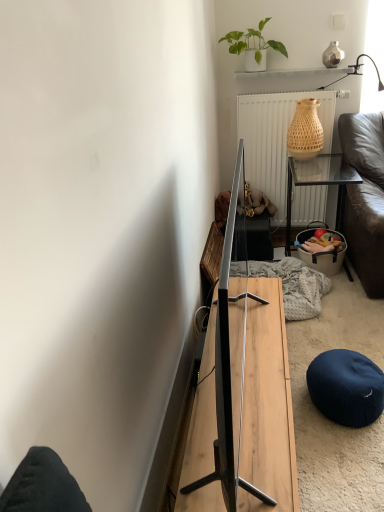
Based on the photo, measure the distance between light wood table at center, marked as the 1th table in a bottom-to-top arrangement, and camera.

The depth of light wood table at center, marked as the 1th table in a bottom-to-top arrangement, is 3.60 feet.

Locate an element on the screen. light wood table at center, arranged as the second table when viewed from the top is located at coordinates (268, 400).

Identify the location of wooden table at right, which is counted as the 2th table, starting from the left. (319, 183).

Identify the location of dark blue fabric stool at lower right. This screenshot has width=384, height=512. (346, 387).

What do you see at coordinates (346, 387) in the screenshot?
I see `dark blue fabric stool at lower right` at bounding box center [346, 387].

Locate an element on the screen. The image size is (384, 512). light wood table at center, positioned as the 2th table in back-to-front order is located at coordinates (268, 400).

Considering the relative sizes of white textured radiator at upper center and light wood table at center, arranged as the second table when viewed from the top, in the image provided, is white textured radiator at upper center shorter than light wood table at center, arranged as the second table when viewed from the top,?

No.

Is white textured radiator at upper center next to light wood table at center, positioned as the 2th table in back-to-front order?

There is a gap between white textured radiator at upper center and light wood table at center, positioned as the 2th table in back-to-front order.

Which is behind, white textured radiator at upper center or light wood table at center, marked as the 1th table in a bottom-to-top arrangement?

white textured radiator at upper center.

Can you tell me how much white textured radiator at upper center and light wood table at center, the first table viewed from the left, differ in facing direction?

88.5 degrees.

From the image's perspective, is white textured radiator at upper center located above or below wooden table at right, the first table from the back?

white textured radiator at upper center is above wooden table at right, the first table from the back.

In terms of size, does white textured radiator at upper center appear bigger or smaller than wooden table at right, the second table when ordered from front to back?

Considering their sizes, white textured radiator at upper center takes up less space than wooden table at right, the second table when ordered from front to back.

How much distance is there between white textured radiator at upper center and wooden table at right, the first table from the back?

white textured radiator at upper center is 7.06 inches away from wooden table at right, the first table from the back.

Where is `radiator on the left of wooden table at right, the first table from the back`? radiator on the left of wooden table at right, the first table from the back is located at coordinates point(275,139).

Considering the points (264, 477) and (267, 116), which point is behind, point (264, 477) or point (267, 116)?

The point (267, 116) is more distant.

Between light wood table at center, arranged as the second table when viewed from the top, and white textured radiator at upper center, which one has more height?

white textured radiator at upper center is taller.

Starting from the white textured radiator at upper center, which table is the 2nd one in front? Please provide its 2D coordinates.

[(268, 400)]

From a real-world perspective, between light wood table at center, the first table viewed from the left, and white textured radiator at upper center, who is vertically lower?

In real-world perspective, light wood table at center, the first table viewed from the left, is lower.

Does light wood table at center, positioned as the 2th table in back-to-front order, come behind wooden table at right, arranged as the first table when viewed from the top?

That is False.

From a real-world perspective, which object rests below the other?

light wood table at center, positioned as the 1th table in front-to-back order.

Is light wood table at center, positioned as the 1th table in front-to-back order, shorter than wooden table at right, which is the second table in bottom-to-top order?

Indeed, light wood table at center, positioned as the 1th table in front-to-back order, has a lesser height compared to wooden table at right, which is the second table in bottom-to-top order.

From the image's perspective, is light wood table at center, the first table viewed from the left, over wooden table at right, the second table when ordered from front to back?

No, from the image's perspective, light wood table at center, the first table viewed from the left, is not above wooden table at right, the second table when ordered from front to back.

Could you tell me if light wood table at center, marked as the 1th table in a bottom-to-top arrangement, is facing green matte plant at upper center?

No, light wood table at center, marked as the 1th table in a bottom-to-top arrangement, is not oriented towards green matte plant at upper center.

Which object is further away from the camera taking this photo, light wood table at center, positioned as the 1th table in front-to-back order, or green matte plant at upper center?

green matte plant at upper center is more distant.

In terms of width, does light wood table at center, positioned as the 1th table in front-to-back order, look wider or thinner when compared to green matte plant at upper center?

Clearly, light wood table at center, positioned as the 1th table in front-to-back order, has more width compared to green matte plant at upper center.

Locate an element on the screen. the 2nd table in front when counting from the green matte plant at upper center is located at coordinates (268, 400).

From a real-world perspective, which object rests below the other?

From a 3D spatial view, dark blue fabric stool at lower right is below.

Does wooden table at right, which is the second table in bottom-to-top order, turn towards dark blue fabric stool at lower right?

Yes, wooden table at right, which is the second table in bottom-to-top order, faces towards dark blue fabric stool at lower right.

Measure the distance between wooden table at right, which is counted as the 2th table, starting from the left, and dark blue fabric stool at lower right.

wooden table at right, which is counted as the 2th table, starting from the left, is 1.28 meters away from dark blue fabric stool at lower right.

Considering the relative sizes of wooden table at right, arranged as the first table when viewed from the top, and dark blue fabric stool at lower right in the image provided, is wooden table at right, arranged as the first table when viewed from the top, wider than dark blue fabric stool at lower right?

Correct, the width of wooden table at right, arranged as the first table when viewed from the top, exceeds that of dark blue fabric stool at lower right.

Are light wood table at center, positioned as the 1th table in front-to-back order, and dark blue fabric stool at lower right far apart?

No, light wood table at center, positioned as the 1th table in front-to-back order, is not far away from dark blue fabric stool at lower right.

How far apart are light wood table at center, arranged as the second table when viewed from the right, and dark blue fabric stool at lower right?

14.61 inches.

The width and height of the screenshot is (384, 512). Find the location of `table that is the 1st object above the dark blue fabric stool at lower right (from a real-world perspective)`. table that is the 1st object above the dark blue fabric stool at lower right (from a real-world perspective) is located at coordinates click(268, 400).

Looking at this image, between light wood table at center, marked as the 1th table in a bottom-to-top arrangement, and dark blue fabric stool at lower right, which one appears on the left side from the viewer's perspective?

From the viewer's perspective, light wood table at center, marked as the 1th table in a bottom-to-top arrangement, appears more on the left side.

Locate an element on the screen. table that is the 2nd one when counting downward from the white textured radiator at upper center (from the image's perspective) is located at coordinates (268, 400).

Find the location of a particular element. radiator that is on the left side of wooden table at right, which is the first table from right to left is located at coordinates (275, 139).

When comparing their distances from wooden table at right, which is the first table from right to left, does green matte plant at upper center or dark blue fabric stool at lower right seem further?

dark blue fabric stool at lower right.

From the image, which object appears to be nearer to wooden table at right, arranged as the first table when viewed from the top, dark blue fabric stool at lower right or green matte plant at upper center?

green matte plant at upper center.

Based on their spatial positions, is light wood table at center, positioned as the 1th table in front-to-back order, or white textured radiator at upper center further from wooden table at right, the second table when ordered from front to back?

light wood table at center, positioned as the 1th table in front-to-back order.

From the image, which object appears to be farther from light wood table at center, the first table viewed from the left, dark blue fabric stool at lower right or green matte plant at upper center?

The object further to light wood table at center, the first table viewed from the left, is green matte plant at upper center.

Looking at the image, which one is located closer to wooden table at right, arranged as the first table when viewed from the top, white textured radiator at upper center or light wood table at center, arranged as the second table when viewed from the right?

white textured radiator at upper center is closer to wooden table at right, arranged as the first table when viewed from the top.

Looking at the image, which one is located closer to dark blue fabric stool at lower right, wooden table at right, which is the first table from right to left, or light wood table at center, arranged as the second table when viewed from the top?

light wood table at center, arranged as the second table when viewed from the top.

Estimate the real-world distances between objects in this image. Which object is closer to dark blue fabric stool at lower right, wooden table at right, which is the first table from right to left, or white textured radiator at upper center?

wooden table at right, which is the first table from right to left.

Based on their spatial positions, is wooden table at right, the first table from the back, or dark blue fabric stool at lower right further from white textured radiator at upper center?

dark blue fabric stool at lower right.

Where is `radiator between green matte plant at upper center and wooden table at right, the second table when ordered from front to back, in the vertical direction`? The height and width of the screenshot is (512, 384). radiator between green matte plant at upper center and wooden table at right, the second table when ordered from front to back, in the vertical direction is located at coordinates (275, 139).

Identify the location of stool located between light wood table at center, positioned as the 2th table in back-to-front order, and white textured radiator at upper center in the depth direction. The height and width of the screenshot is (512, 384). (346, 387).

Find the location of a particular element. Image resolution: width=384 pixels, height=512 pixels. radiator between green matte plant at upper center and dark blue fabric stool at lower right in the up-down direction is located at coordinates (275, 139).

You are a GUI agent. You are given a task and a screenshot of the screen. Output one action in this format:
    pyautogui.click(x=<x>, y=<y>)
    Task: Click on the stool between light wood table at center, arranged as the second table when viewed from the top, and wooden table at right, arranged as the first table when viewed from the top, in the front-back direction
    
    Given the screenshot: What is the action you would take?
    pyautogui.click(x=346, y=387)